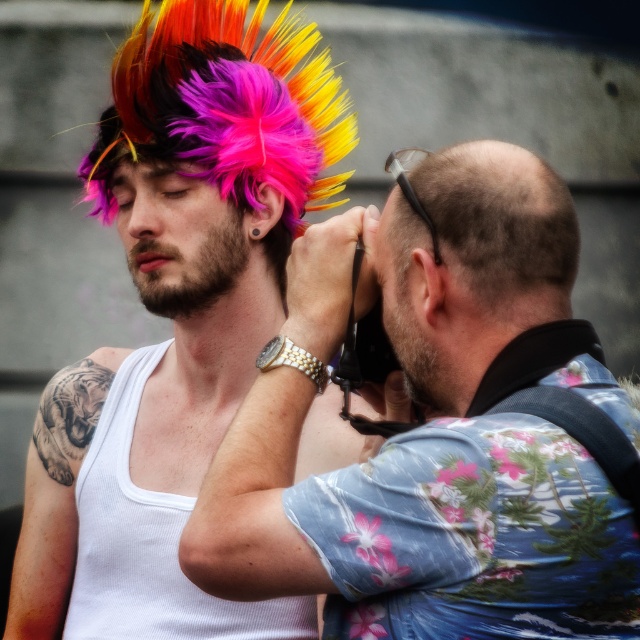
You are a photographer trying to capture a photo of the two subjects. The multicolored feathered wig at center and the floral print shirt at right are important elements in the frame. Which object should you focus on first if you want to ensure both are in focus?

The multicolored feathered wig at center is positioned on the left side of floral print shirt at right, so focusing on the multicolored feathered wig at center first would help ensure both are in focus since it is closer to the camera.

You are standing at the point marked as point [321,356] and want to take a photo of the person with the colorful punk wig. Considering the distance between you and them is 2.84 meters, will you be able to capture their entire body in the photo if your camera has a standard 50mm lens?

The distance between you and the person with the colorful punk wig is 2.84 meters. With a standard 50mm lens, this distance should allow capturing their entire body, as typical framing for full body shots is achievable at such a distance depending on the camera sensor size. However, slight adjustments might be needed for optimal composition.

You are standing at the point with coordinates [177,317] in the image. What object are you directly facing?

The point at [177,317] corresponds to the multicolored feathered wig at center, so you are directly facing the multicolored feathered wig at center.